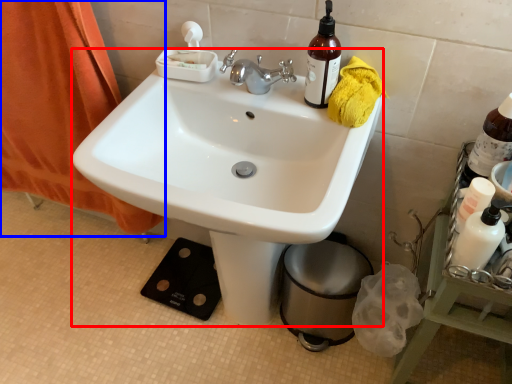
Question: Which object is further to the camera taking this photo, sink (highlighted by a red box) or curtain (highlighted by a blue box)?

Choices:
 (A) sink
 (B) curtain

Answer: (B)